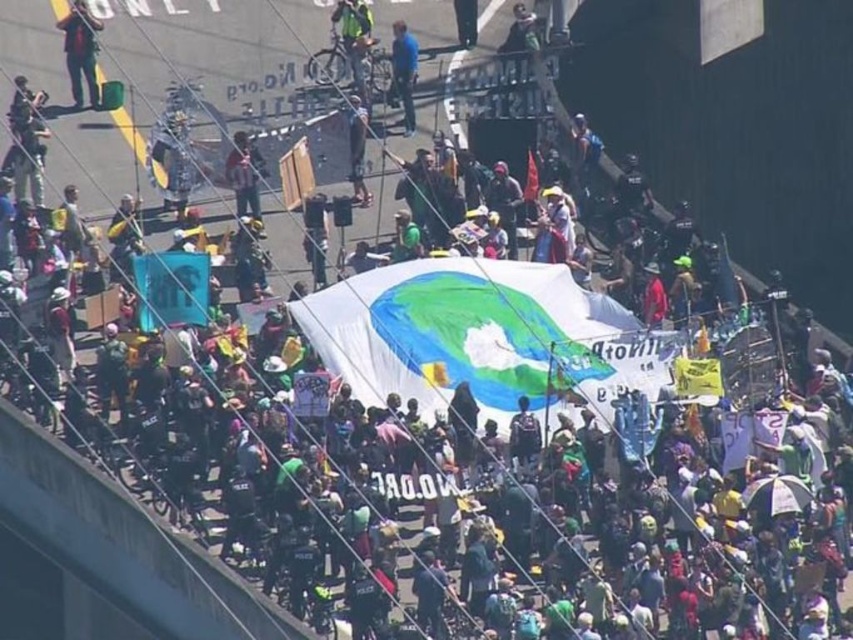
Which is in front, point (238, 193) or point (398, 49)?

Positioned in front is point (238, 193).

Between striped shirt at center and blue fabric at center, which one has less height?

blue fabric at center is shorter.

Is point (236, 176) farther from viewer compared to point (390, 52)?

No, (236, 176) is closer to viewer.

Find the location of a particular element. This screenshot has height=640, width=853. striped shirt at center is located at coordinates (242, 176).

Is point (83, 54) positioned before point (248, 164)?

No, it is not.

Who is more forward, [80,52] or [242,179]?

Point [242,179] is in front.

Image resolution: width=853 pixels, height=640 pixels. What are the coordinates of `matte black pants at upper left` in the screenshot? It's located at (80, 51).

Does matte black pants at upper left appear on the right side of blue fabric at center?

No, matte black pants at upper left is not to the right of blue fabric at center.

Which is in front, point (67, 35) or point (404, 131)?

Point (67, 35) is in front.

You are a GUI agent. You are given a task and a screenshot of the screen. Output one action in this format:
    pyautogui.click(x=<x>, y=<y>)
    Task: Click on the matte black pants at upper left
    
    Given the screenshot: What is the action you would take?
    pyautogui.click(x=80, y=51)